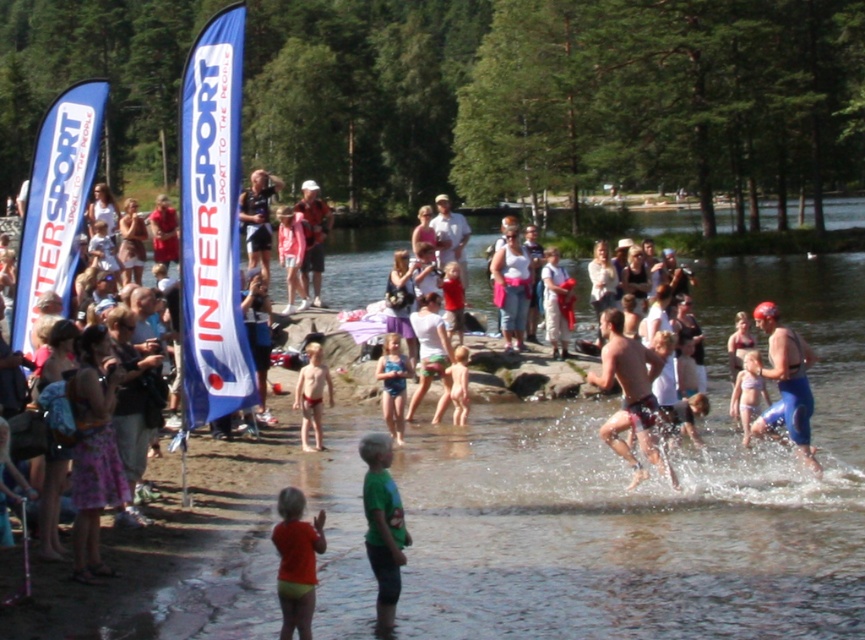
Question: Is orange swimsuit at lower center thinner than matte red swimsuit at center?

Choices:
 (A) yes
 (B) no

Answer: (A)

Question: Among these points, which one is nearest to the camera?

Choices:
 (A) (391, 330)
 (B) (445, 208)
 (C) (248, 248)

Answer: (A)

Question: In this image, where is blue fabric banner at left located relative to smooth skin man at center?

Choices:
 (A) right
 (B) left

Answer: (B)

Question: Based on their relative distances, which object is nearer to the light brown fabric dress at center?

Choices:
 (A) matte blue shorts at center
 (B) blue spandex swim suit at right
 (C) matte red swimsuit at center

Answer: (A)

Question: Is the position of matte blue shorts at center more distant than that of matte white dress at center?

Choices:
 (A) yes
 (B) no

Answer: (B)

Question: Which of the following is the closest to the observer?

Choices:
 (A) (394, 257)
 (B) (511, 321)
 (C) (245, 298)

Answer: (C)